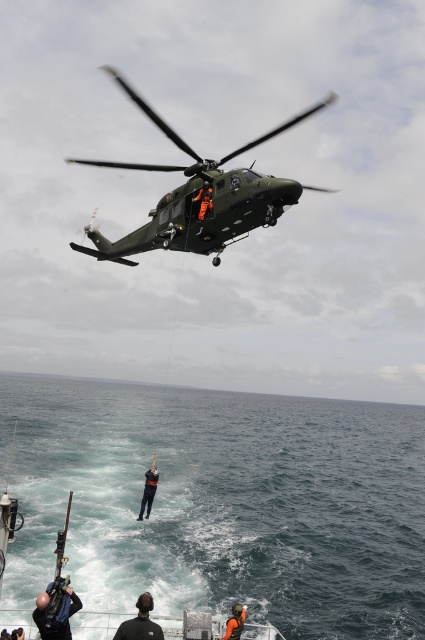
Can you confirm if dark blue water at center is positioned above black fabric person at lower center?

No, dark blue water at center is not above black fabric person at lower center.

Which is more to the right, dark blue water at center or black fabric person at lower center?

black fabric person at lower center

Does point (257, 516) come behind point (144, 609)?

Yes, it is behind point (144, 609).

What are the coordinates of `dark blue water at center` in the screenshot? It's located at (221, 502).

Can you confirm if black fabric person at lower center is shorter than orange life vest at lower center?

Yes.

Does black fabric person at lower center have a lesser width compared to orange life vest at lower center?

Incorrect, black fabric person at lower center's width is not less than orange life vest at lower center's.

Between point (149, 596) and point (237, 604), which one is positioned behind?

Positioned behind is point (237, 604).

Where is `black fabric person at lower center`? The height and width of the screenshot is (640, 425). black fabric person at lower center is located at coordinates (139, 621).

Is matte green helicopter at upper center in front of dark blue fabric at center?

Yes.

Is matte green helicopter at upper center further to camera compared to dark blue fabric at center?

That is False.

Between point (195, 228) and point (158, 472), which one is positioned behind?

Positioned behind is point (158, 472).

Locate an element on the screen. matte green helicopter at upper center is located at coordinates (201, 196).